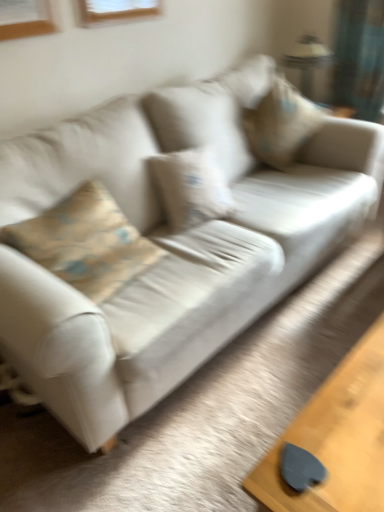
Question: From a real-world perspective, does smooth wooden table at lower right stand above metallic silver lamp at upper right?

Choices:
 (A) yes
 (B) no

Answer: (B)

Question: Is smooth wooden table at lower right next to metallic silver lamp at upper right?

Choices:
 (A) yes
 (B) no

Answer: (B)

Question: Is smooth wooden table at lower right positioned with its back to metallic silver lamp at upper right?

Choices:
 (A) yes
 (B) no

Answer: (B)

Question: Is smooth wooden table at lower right outside of metallic silver lamp at upper right?

Choices:
 (A) no
 (B) yes

Answer: (B)

Question: Is smooth wooden table at lower right oriented towards metallic silver lamp at upper right?

Choices:
 (A) yes
 (B) no

Answer: (B)

Question: Is beige fabric pillow at upper right to the left or to the right of metallic silver lamp at upper right in the image?

Choices:
 (A) left
 (B) right

Answer: (A)

Question: From the image's perspective, is beige fabric pillow at upper right located above or below metallic silver lamp at upper right?

Choices:
 (A) below
 (B) above

Answer: (A)

Question: Is beige fabric pillow at upper right spatially inside metallic silver lamp at upper right, or outside of it?

Choices:
 (A) outside
 (B) inside

Answer: (A)

Question: Considering the positions of beige fabric pillow at upper right and metallic silver lamp at upper right in the image, is beige fabric pillow at upper right wider or thinner than metallic silver lamp at upper right?

Choices:
 (A) thin
 (B) wide

Answer: (B)

Question: Considering the positions of smooth wooden table at lower right and metallic silver lamp at upper right in the image, is smooth wooden table at lower right wider or thinner than metallic silver lamp at upper right?

Choices:
 (A) thin
 (B) wide

Answer: (A)

Question: From the image's perspective, is smooth wooden table at lower right positioned above or below metallic silver lamp at upper right?

Choices:
 (A) below
 (B) above

Answer: (A)

Question: Considering the positions of smooth wooden table at lower right and metallic silver lamp at upper right in the image, is smooth wooden table at lower right bigger or smaller than metallic silver lamp at upper right?

Choices:
 (A) small
 (B) big

Answer: (B)

Question: Is point (367, 366) closer or farther from the camera than point (319, 58)?

Choices:
 (A) closer
 (B) farther

Answer: (A)

Question: Is metallic silver lamp at upper right bigger or smaller than smooth wooden table at lower right?

Choices:
 (A) small
 (B) big

Answer: (A)

Question: Relative to smooth wooden table at lower right, is metallic silver lamp at upper right in front or behind?

Choices:
 (A) front
 (B) behind

Answer: (B)